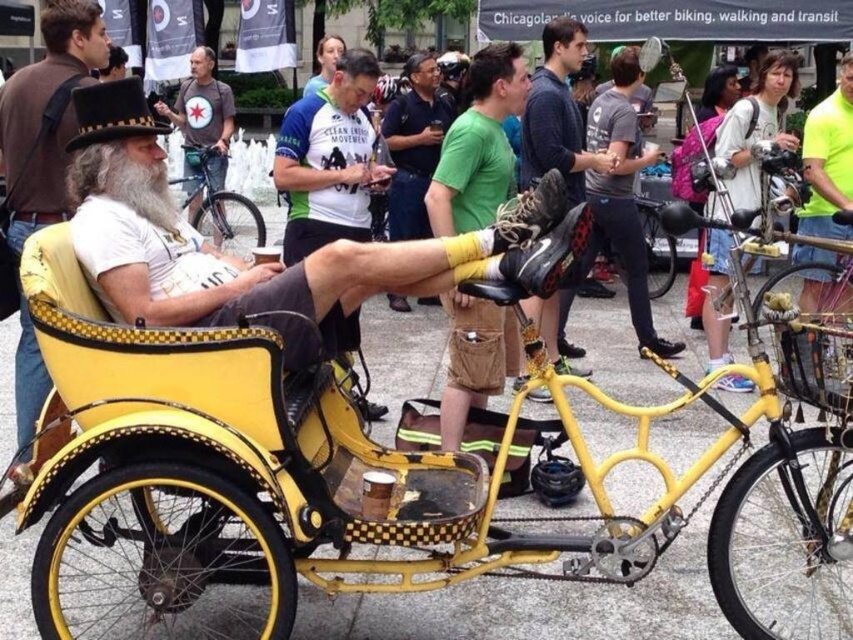
Question: Is matte black shoe at center positioned in front of matte gray t-shirt at center?

Choices:
 (A) yes
 (B) no

Answer: (A)

Question: Can you confirm if gray cotton t-shirt at center is positioned to the left of matte black shoe at center?

Choices:
 (A) yes
 (B) no

Answer: (B)

Question: Is neon yellow shirt at right behind shiny metallic bicycle at center?

Choices:
 (A) yes
 (B) no

Answer: (B)

Question: Which object appears closest to the camera in this image?

Choices:
 (A) green cotton shirt at center
 (B) shiny metallic bicycle at center

Answer: (A)

Question: Which of the following is the closest to the observer?

Choices:
 (A) (219, 92)
 (B) (251, 296)

Answer: (B)

Question: Among these points, which one is farthest from the camera?

Choices:
 (A) (85, 33)
 (B) (627, 260)
 (C) (218, 161)
 (D) (537, 177)

Answer: (C)